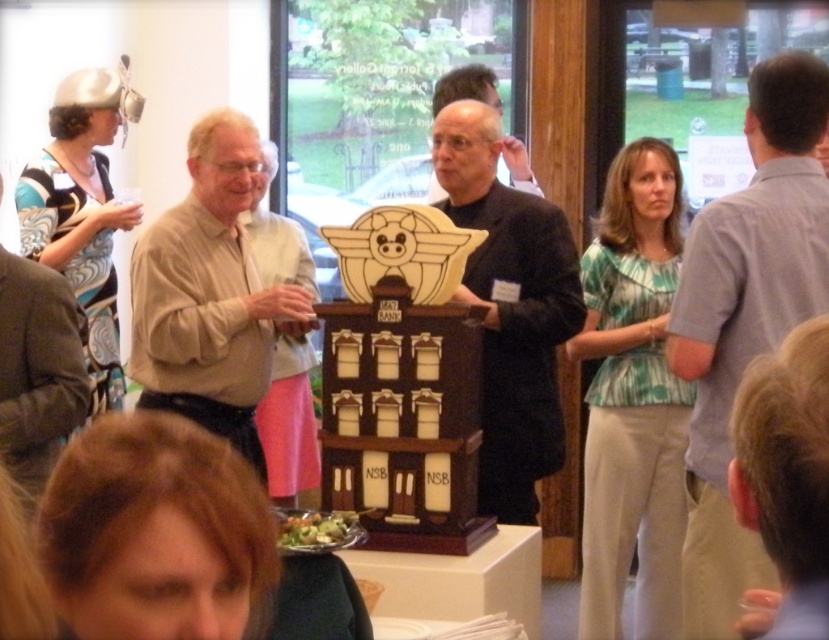
You are attending an awards ceremony and need to choose an outfit to wear. You have a dark brown suit at center and a brown leather jacket at upper left available. Which one would you recommend for a formal event?

The dark brown suit at center is larger in size compared to the brown leather jacket at upper left, making it more suitable for a formal event as it conveys a more professional and polished appearance.

You are at a formal event and see the matte beige shirt at left and the dark brown suit at center. Which person is positioned more to the left side of the room?

The matte beige shirt at left is positioned more to the left side of the room than the dark brown suit at center.